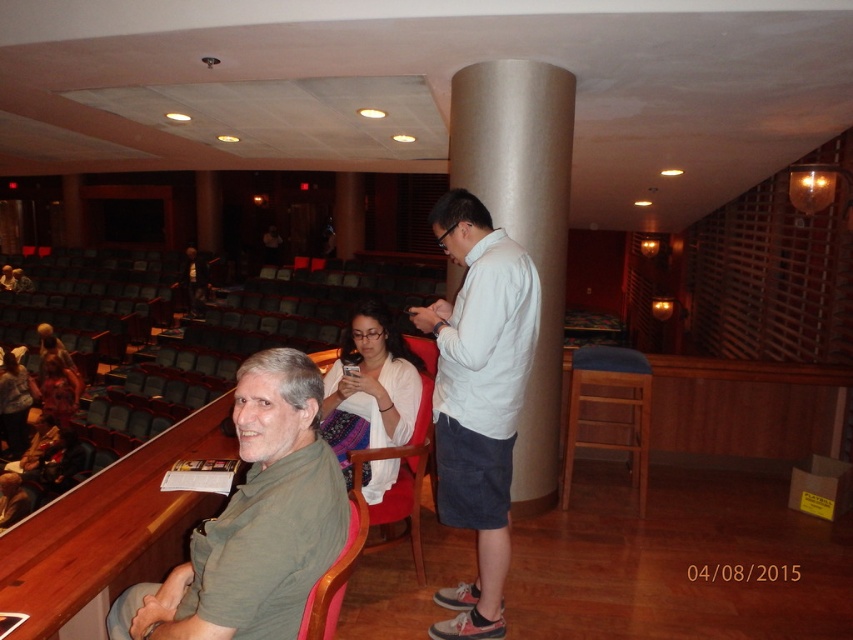
Question: Is green matte shirt at lower left below white fabric at center?

Choices:
 (A) yes
 (B) no

Answer: (A)

Question: Does white matte shirt at center have a greater width compared to red fabric chair at center?

Choices:
 (A) yes
 (B) no

Answer: (A)

Question: Which object appears closest to the camera in this image?

Choices:
 (A) matte white sweater at lower left
 (B) green matte shirt at lower left
 (C) satin silver column at center
 (D) red fabric chair at center

Answer: (B)

Question: Estimate the real-world distances between objects in this image. Which object is closer to the red fabric chair at center?

Choices:
 (A) white matte shirt at center
 (B) white fabric at center
 (C) satin silver column at center
 (D) matte white sweater at lower left

Answer: (B)

Question: Is white fabric at center bigger than wooden chair at lower left?

Choices:
 (A) yes
 (B) no

Answer: (A)

Question: Among these points, which one is nearest to the camera?

Choices:
 (A) (340, 582)
 (B) (393, 333)

Answer: (A)